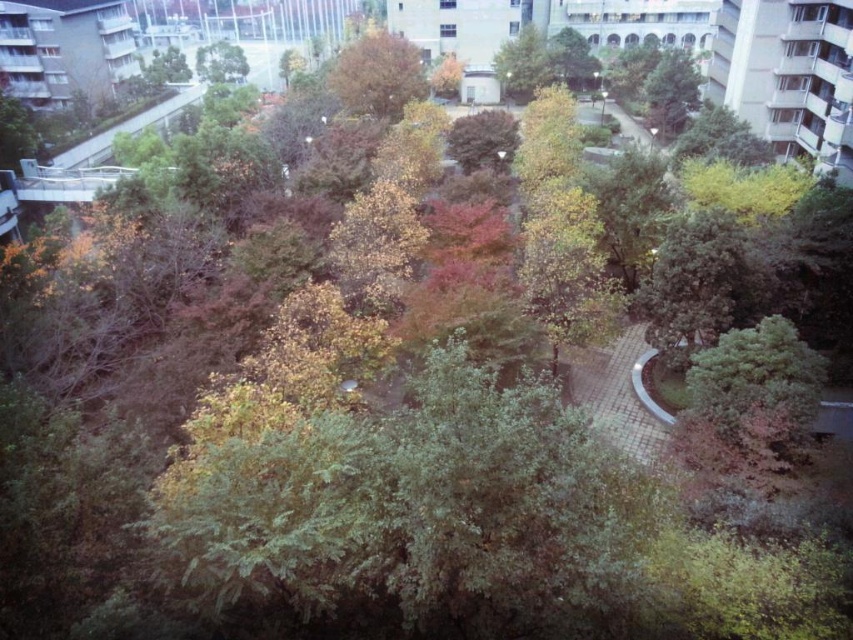
Is brown textured tree at center bigger than green leafy tree at upper center?

Yes, brown textured tree at center is bigger than green leafy tree at upper center.

Which is more to the left, brown textured tree at center or green leafy tree at upper center?

From the viewer's perspective, green leafy tree at upper center appears more on the left side.

Does point (415, 83) come in front of point (233, 44)?

Yes, it is in front of point (233, 44).

This screenshot has height=640, width=853. What are the coordinates of `brown textured tree at center` in the screenshot? It's located at (376, 76).